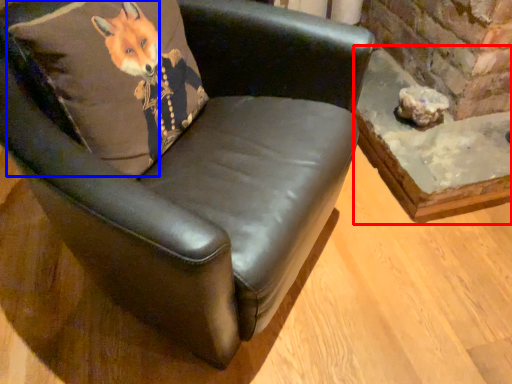
Question: Which object appears farthest to the camera in this image, table (highlighted by a red box) or pillow (highlighted by a blue box)?

Choices:
 (A) table
 (B) pillow

Answer: (A)